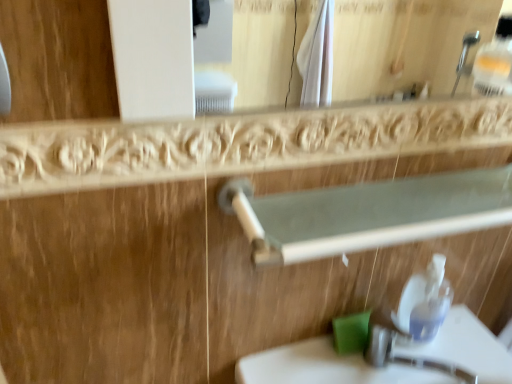
Identify the location of empty space that is ontop of white glossy sink at lower center (from a real-world perspective). (396, 357).